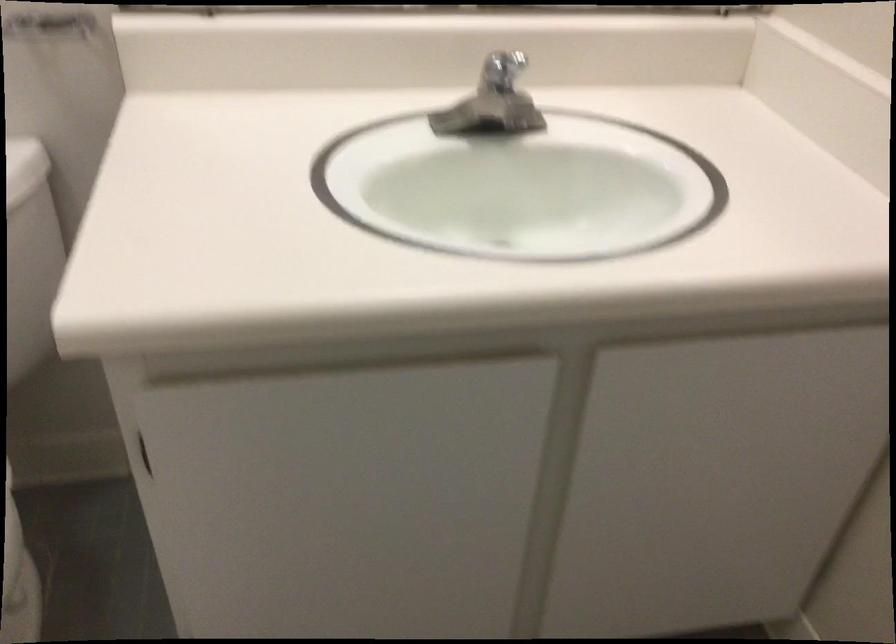
Where is `faucet handle`? faucet handle is located at coordinates 503,70.